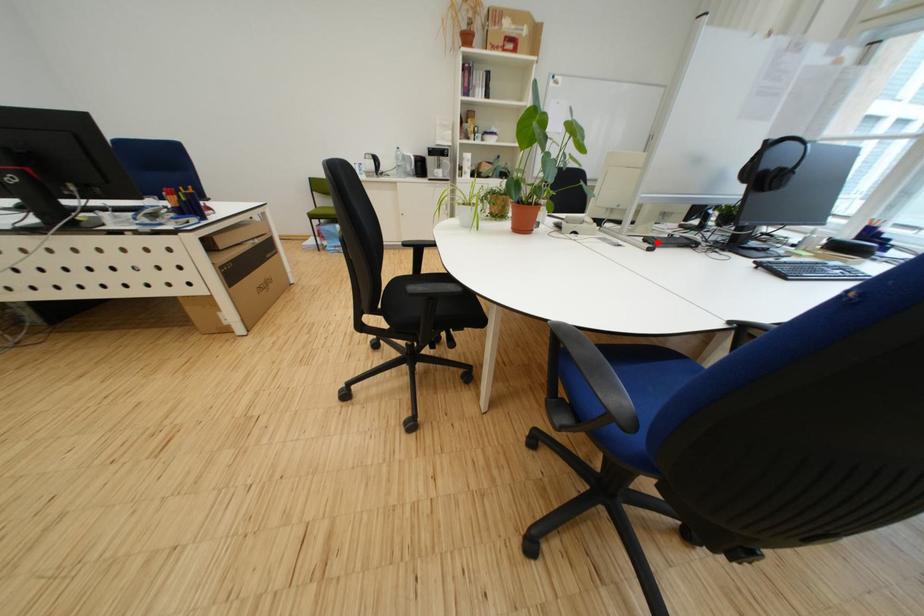
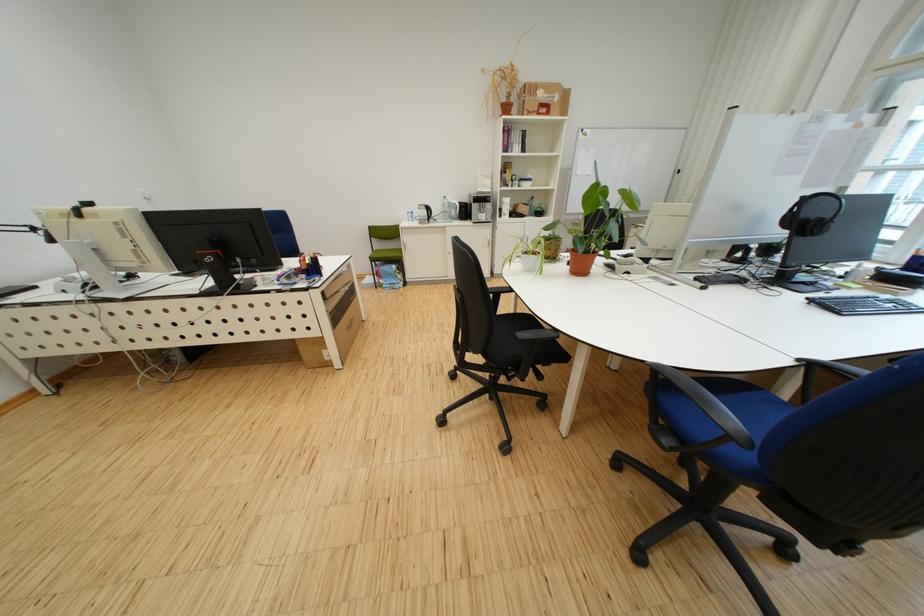
Question: I am providing you with two images of the same scene from different viewpoints. A red point is marked on the first image. Is the red point's position out of view in image 2?

Choices:
 (A) Yes
 (B) No

Answer: (B)